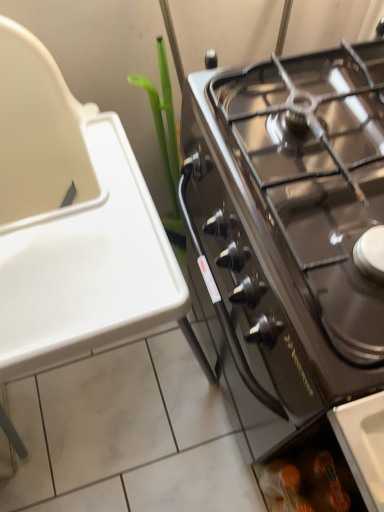
Question: Considering the positions of translucent plastic bag at lower right and green plastic plant at upper left in the image, is translucent plastic bag at lower right taller or shorter than green plastic plant at upper left?

Choices:
 (A) short
 (B) tall

Answer: (A)

Question: Is translucent plastic bag at lower right in front of or behind green plastic plant at upper left in the image?

Choices:
 (A) front
 (B) behind

Answer: (B)

Question: Which is nearer to the green plastic plant at upper left?

Choices:
 (A) translucent plastic bag at lower right
 (B) black glass gas stove at right

Answer: (B)

Question: Estimate the real-world distances between objects in this image. Which object is closer to the translucent plastic bag at lower right?

Choices:
 (A) black glass gas stove at right
 (B) green plastic plant at upper left

Answer: (A)